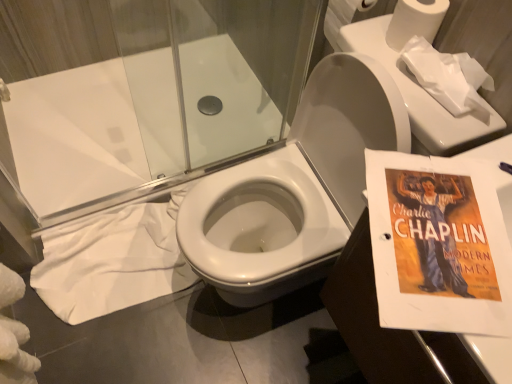
Question: Does white matte toilet paper at upper right, the second toilet paper viewed from the front, have a larger size compared to matte paper charlie chaplin poster at right?

Choices:
 (A) no
 (B) yes

Answer: (A)

Question: Is white matte toilet paper at upper right, the second toilet paper viewed from the front, aimed at matte paper charlie chaplin poster at right?

Choices:
 (A) yes
 (B) no

Answer: (B)

Question: From the image's perspective, is white matte toilet paper at upper right, which is the 2th toilet paper from back to front, over matte paper charlie chaplin poster at right?

Choices:
 (A) yes
 (B) no

Answer: (A)

Question: Is white matte toilet paper at upper right, the second toilet paper viewed from the front, shorter than matte paper charlie chaplin poster at right?

Choices:
 (A) no
 (B) yes

Answer: (B)

Question: From a real-world perspective, is white matte toilet paper at upper right, the second toilet paper viewed from the front, beneath matte paper charlie chaplin poster at right?

Choices:
 (A) no
 (B) yes

Answer: (A)

Question: Are white matte toilet paper at upper right, the second toilet paper viewed from the front, and matte paper charlie chaplin poster at right beside each other?

Choices:
 (A) no
 (B) yes

Answer: (A)

Question: Considering the relative sizes of white paper at upper right, which is counted as the 3th toilet paper, starting from the back, and matte paper charlie chaplin poster at right in the image provided, is white paper at upper right, which is counted as the 3th toilet paper, starting from the back, thinner than matte paper charlie chaplin poster at right?

Choices:
 (A) no
 (B) yes

Answer: (B)

Question: Is white paper at upper right, which appears as the 1th toilet paper when viewed from the front, oriented away from matte paper charlie chaplin poster at right?

Choices:
 (A) yes
 (B) no

Answer: (B)

Question: Does white paper at upper right, which appears as the 1th toilet paper when viewed from the front, come behind matte paper charlie chaplin poster at right?

Choices:
 (A) no
 (B) yes

Answer: (B)

Question: From the image's perspective, is white paper at upper right, which is counted as the 3th toilet paper, starting from the back, under matte paper charlie chaplin poster at right?

Choices:
 (A) no
 (B) yes

Answer: (A)

Question: Considering the relative positions of white paper at upper right, which appears as the 1th toilet paper when viewed from the front, and matte paper charlie chaplin poster at right in the image provided, is white paper at upper right, which appears as the 1th toilet paper when viewed from the front, to the right of matte paper charlie chaplin poster at right from the viewer's perspective?

Choices:
 (A) yes
 (B) no

Answer: (B)

Question: Is white paper at upper right, which is counted as the 3th toilet paper, starting from the back, to the left of matte paper charlie chaplin poster at right from the viewer's perspective?

Choices:
 (A) no
 (B) yes

Answer: (B)

Question: Is matte paper charlie chaplin poster at right next to white fabric at lower left?

Choices:
 (A) yes
 (B) no

Answer: (B)